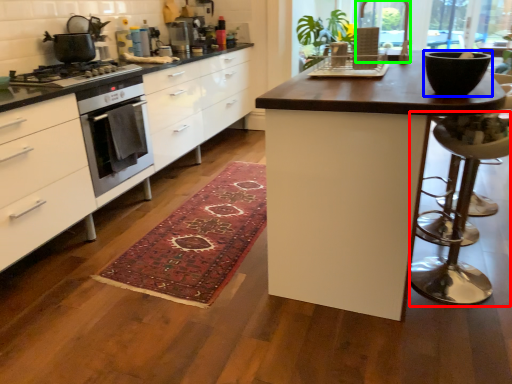
Question: Based on their relative distances, which object is nearer to bar stool (highlighted by a red box)? Choose from bowl (highlighted by a blue box) and window screen (highlighted by a green box).

Choices:
 (A) bowl
 (B) window screen

Answer: (A)